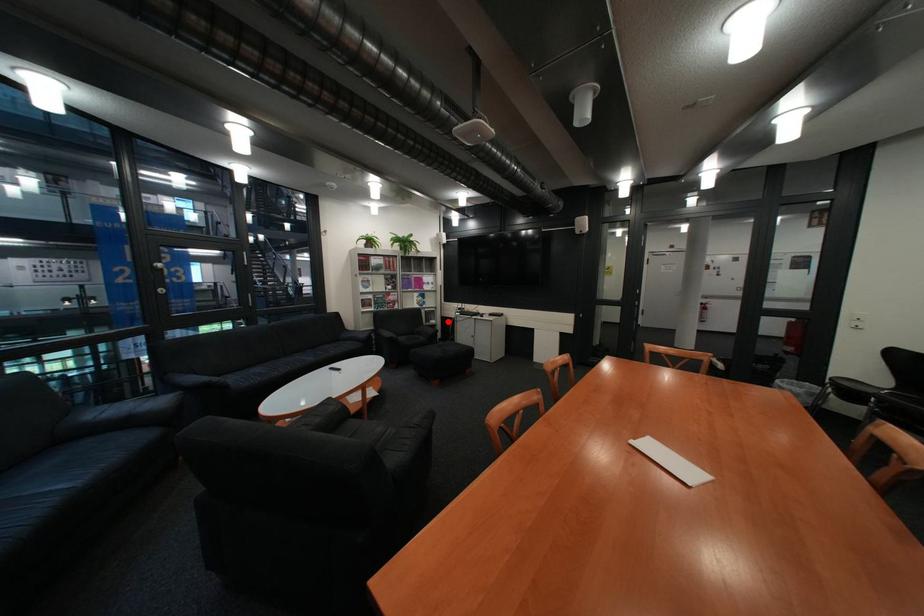
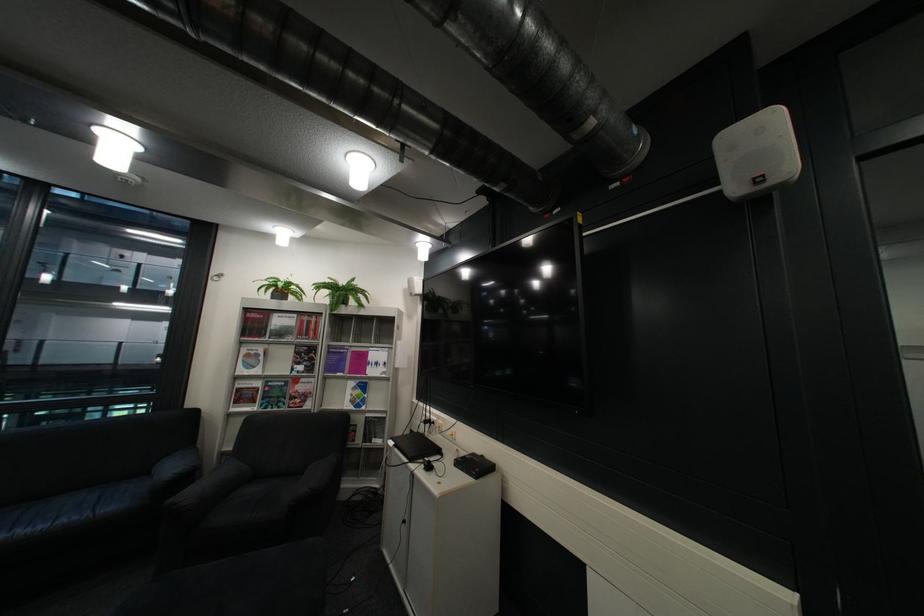
Locate, in the second image, the point that corresponds to the highlighted location in the first image.

(393, 442)